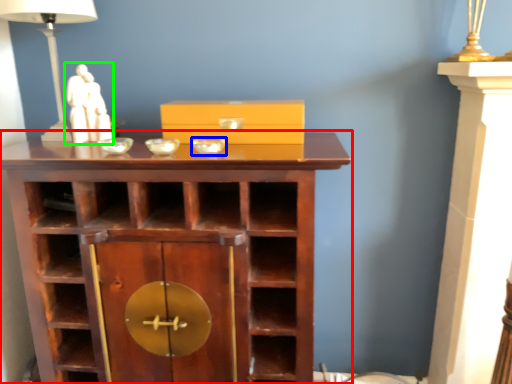
Question: Considering the real-world distances, which object is farthest from shelf (highlighted by a red box)? glass bowl (highlighted by a blue box) or sculpture (highlighted by a green box)?

Choices:
 (A) glass bowl
 (B) sculpture

Answer: (B)